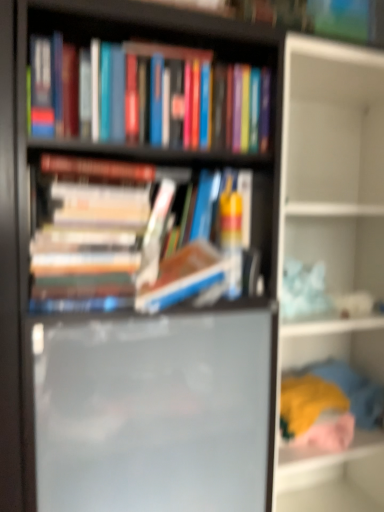
Question: Is soft fabric clothes at lower right, the second shelf in the top-to-bottom sequence, completely or partially inside hardcover books at center, which appears as the first book when ordered from the bottom?

Choices:
 (A) yes
 (B) no

Answer: (B)

Question: From a real-world perspective, is hardcover books at center, positioned as the second book in top-to-bottom order, positioned over soft fabric clothes at lower right, the first shelf ordered from the bottom, based on gravity?

Choices:
 (A) yes
 (B) no

Answer: (A)

Question: Does hardcover books at center, which appears as the first book when ordered from the bottom, have a smaller size compared to soft fabric clothes at lower right, the second shelf in the top-to-bottom sequence?

Choices:
 (A) no
 (B) yes

Answer: (A)

Question: Is the surface of hardcover books at center, positioned as the second book in top-to-bottom order, in direct contact with soft fabric clothes at lower right, the first shelf ordered from the bottom?

Choices:
 (A) yes
 (B) no

Answer: (B)

Question: Is hardcover books at center, which appears as the first book when ordered from the bottom, to the right of soft fabric clothes at lower right, the second shelf in the top-to-bottom sequence, from the viewer's perspective?

Choices:
 (A) no
 (B) yes

Answer: (A)

Question: Based on their sizes in the image, would you say hardcover books at center, which appears as the first book when ordered from the bottom, is bigger or smaller than hardcover books at upper center, the 1th book from the top?

Choices:
 (A) small
 (B) big

Answer: (A)

Question: Is point (44, 239) closer or farther from the camera than point (145, 80)?

Choices:
 (A) closer
 (B) farther

Answer: (A)

Question: Is hardcover books at center, which appears as the first book when ordered from the bottom, in front of or behind hardcover books at upper center, which appears as the second book when ordered from the bottom, in the image?

Choices:
 (A) behind
 (B) front

Answer: (B)

Question: Is hardcover books at center, which appears as the first book when ordered from the bottom, to the left or to the right of hardcover books at upper center, which appears as the second book when ordered from the bottom, in the image?

Choices:
 (A) right
 (B) left

Answer: (B)

Question: Based on their sizes in the image, would you say soft fabric clothes at lower right, the first shelf ordered from the bottom, is bigger or smaller than hardcover books at upper center, the 1th book from the top?

Choices:
 (A) small
 (B) big

Answer: (A)

Question: From their relative heights in the image, would you say soft fabric clothes at lower right, the first shelf ordered from the bottom, is taller or shorter than hardcover books at upper center, which appears as the second book when ordered from the bottom?

Choices:
 (A) tall
 (B) short

Answer: (B)

Question: Considering the positions of point (364, 436) and point (145, 100), is point (364, 436) closer or farther from the camera than point (145, 100)?

Choices:
 (A) farther
 (B) closer

Answer: (A)

Question: From a real-world perspective, is soft fabric clothes at lower right, the first shelf ordered from the bottom, physically located above or below hardcover books at upper center, which appears as the second book when ordered from the bottom?

Choices:
 (A) above
 (B) below

Answer: (B)

Question: From the image's perspective, relative to soft fabric clothes at lower right, the first shelf ordered from the bottom, is matte black bookshelf at center above or below?

Choices:
 (A) below
 (B) above

Answer: (B)

Question: In the image, is matte black bookshelf at center on the left side or the right side of soft fabric clothes at lower right, the first shelf ordered from the bottom?

Choices:
 (A) left
 (B) right

Answer: (A)